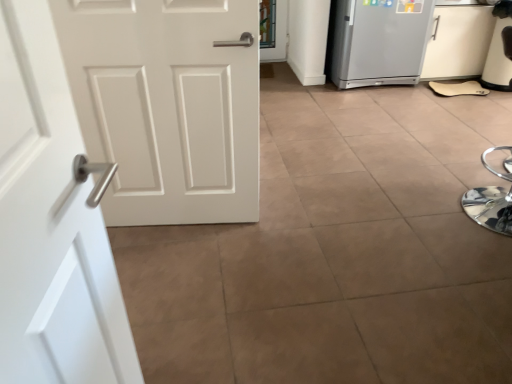
Describe the element at coordinates (51, 224) in the screenshot. I see `white matte door at left` at that location.

At what (x,y) coordinates should I click in order to perform the action: click on white matte door at left. Please return your answer as a coordinate pair (x, y). This screenshot has width=512, height=384. Looking at the image, I should click on (x=51, y=224).

In order to face white matte door at left, should I rotate leftwards or rightwards?

It's best to rotate left around 21.284 degrees.

You are a GUI agent. You are given a task and a screenshot of the screen. Output one action in this format:
    pyautogui.click(x=<x>, y=<y>)
    Task: Click on the silver metallic refrigerator at upper right
    
    Given the screenshot: What is the action you would take?
    pyautogui.click(x=379, y=42)

Describe the element at coordinates (379, 42) in the screenshot. The width and height of the screenshot is (512, 384). I see `silver metallic refrigerator at upper right` at that location.

This screenshot has width=512, height=384. Find the location of `white matte door at left`. white matte door at left is located at coordinates (51, 224).

Between silver metallic refrigerator at upper right and white matte door at left, which one appears on the right side from the viewer's perspective?

silver metallic refrigerator at upper right is more to the right.

Which object is closer to the camera, silver metallic refrigerator at upper right or white matte door at left?

white matte door at left.

Does point (352, 58) come behind point (19, 378)?

Yes, it is behind point (19, 378).

From the image's perspective, does silver metallic refrigerator at upper right appear higher than white matte door at left?

Correct, silver metallic refrigerator at upper right appears higher than white matte door at left in the image.

Based on the photo, from a real-world perspective, which object stands above the other?

From a 3D spatial view, white matte door at left is above.

Considering the sizes of silver metallic refrigerator at upper right and white matte door at left in the image, is silver metallic refrigerator at upper right wider or thinner than white matte door at left?

Clearly, silver metallic refrigerator at upper right has more width compared to white matte door at left.

Considering the sizes of objects silver metallic refrigerator at upper right and white matte door at left in the image provided, who is taller, silver metallic refrigerator at upper right or white matte door at left?

white matte door at left is taller.

In terms of size, does silver metallic refrigerator at upper right appear bigger or smaller than white matte door at left?

Clearly, silver metallic refrigerator at upper right is larger in size than white matte door at left.

Do you think silver metallic refrigerator at upper right is within white matte door at left, or outside of it?

silver metallic refrigerator at upper right is not enclosed by white matte door at left.

Would you consider silver metallic refrigerator at upper right to be distant from white matte door at left?

Absolutely, silver metallic refrigerator at upper right is distant from white matte door at left.

Does silver metallic refrigerator at upper right turn towards white matte door at left?

No, silver metallic refrigerator at upper right is not aimed at white matte door at left.

What's the angular difference between silver metallic refrigerator at upper right and white matte door at left's facing directions?

silver metallic refrigerator at upper right and white matte door at left are facing 81.3 degrees away from each other.

Measure the distance from silver metallic refrigerator at upper right to white matte door at left.

silver metallic refrigerator at upper right and white matte door at left are 2.99 meters apart from each other.

The height and width of the screenshot is (384, 512). What are the coordinates of `door in front of the silver metallic refrigerator at upper right` in the screenshot? It's located at (51, 224).

Which is more to the left, white matte door at left or silver metallic refrigerator at upper right?

Positioned to the left is white matte door at left.

Is white matte door at left behind silver metallic refrigerator at upper right?

No, the depth of white matte door at left is less than that of silver metallic refrigerator at upper right.

Does point (21, 363) come farther from viewer compared to point (418, 26)?

No, (21, 363) is in front of (418, 26).

From the image's perspective, would you say white matte door at left is positioned over silver metallic refrigerator at upper right?

Actually, white matte door at left appears below silver metallic refrigerator at upper right in the image.

From a real-world perspective, is white matte door at left positioned above or below silver metallic refrigerator at upper right?

In terms of real-world spatial position, white matte door at left is above silver metallic refrigerator at upper right.

Considering the sizes of objects white matte door at left and silver metallic refrigerator at upper right in the image provided, who is thinner, white matte door at left or silver metallic refrigerator at upper right?

white matte door at left.

Considering the relative sizes of white matte door at left and silver metallic refrigerator at upper right in the image provided, is white matte door at left shorter than silver metallic refrigerator at upper right?

No, white matte door at left is not shorter than silver metallic refrigerator at upper right.

Does white matte door at left have a larger size compared to silver metallic refrigerator at upper right?

Actually, white matte door at left might be smaller than silver metallic refrigerator at upper right.

Does white matte door at left contain silver metallic refrigerator at upper right?

No, silver metallic refrigerator at upper right is not surrounded by white matte door at left.

Is the surface of white matte door at left in direct contact with silver metallic refrigerator at upper right?

There is a gap between white matte door at left and silver metallic refrigerator at upper right.

Is white matte door at left looking in the opposite direction of silver metallic refrigerator at upper right?

No, white matte door at left is not facing away from silver metallic refrigerator at upper right.

How different are the orientations of white matte door at left and silver metallic refrigerator at upper right in degrees?

There is a 81.3-degree angle between the facing directions of white matte door at left and silver metallic refrigerator at upper right.

This screenshot has width=512, height=384. I want to click on door below the silver metallic refrigerator at upper right (from the image's perspective), so click(51, 224).

Image resolution: width=512 pixels, height=384 pixels. In order to click on refrigerator above the white matte door at left (from the image's perspective) in this screenshot , I will do `click(379, 42)`.

You are a GUI agent. You are given a task and a screenshot of the screen. Output one action in this format:
    pyautogui.click(x=<x>, y=<y>)
    Task: Click on the door on the left of silver metallic refrigerator at upper right
    The height and width of the screenshot is (384, 512).
    Given the screenshot: What is the action you would take?
    pyautogui.click(x=51, y=224)